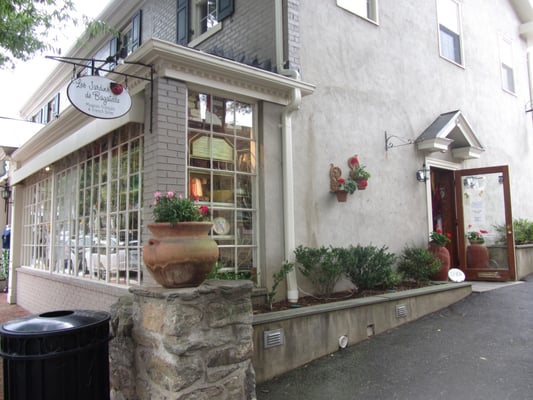
You are a GUI agent. You are given a task and a screenshot of the screen. Output one action in this format:
    pyautogui.click(x=<x>, y=<y>)
    Task: Click on the recycling container
    The width and height of the screenshot is (533, 400).
    Given the screenshot: What is the action you would take?
    pyautogui.click(x=49, y=327), pyautogui.click(x=61, y=371)